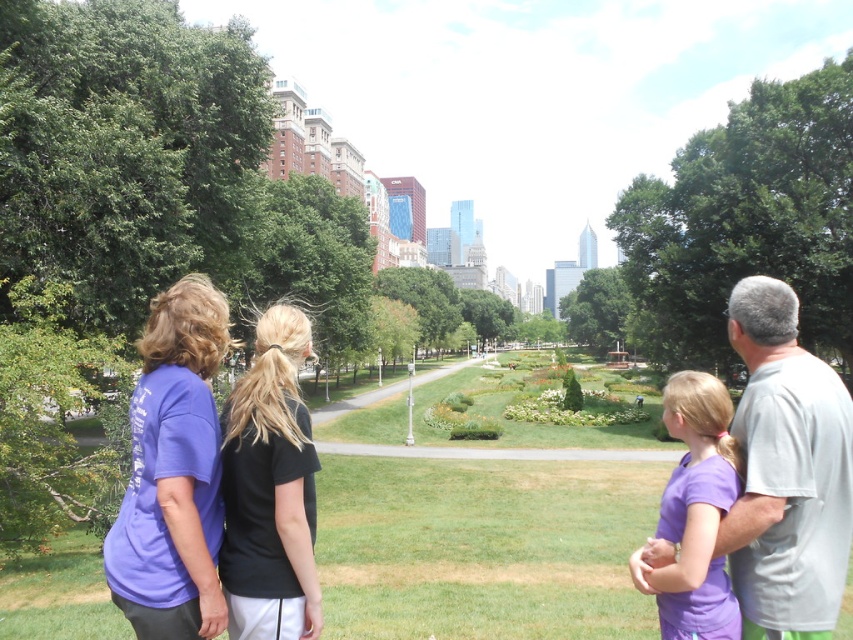
Question: Can you confirm if black matte shirt at center is positioned to the left of purple matte shirt at lower right?

Choices:
 (A) no
 (B) yes

Answer: (B)

Question: Which object is farther from the camera taking this photo?

Choices:
 (A) purple cotton t-shirt at left
 (B) purple matte shirt at lower right
 (C) gray cotton shirt at right
 (D) black matte shirt at center

Answer: (D)

Question: Which point is farther from the camera taking this photo?

Choices:
 (A) (204, 557)
 (B) (231, 532)
 (C) (746, 598)
 (D) (723, 611)

Answer: (B)

Question: Which point is farther to the camera?

Choices:
 (A) purple matte shirt at lower right
 (B) black matte shirt at center

Answer: (B)

Question: Can you confirm if gray cotton shirt at right is positioned above purple matte shirt at lower right?

Choices:
 (A) yes
 (B) no

Answer: (A)

Question: Does purple cotton t-shirt at left have a larger size compared to black matte shirt at center?

Choices:
 (A) yes
 (B) no

Answer: (A)